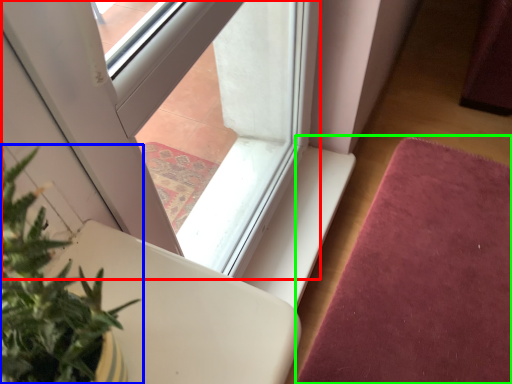
Question: Which object is the closest to the window (highlighted by a red box)? Choose among these: houseplant (highlighted by a blue box) or mat (highlighted by a green box).

Choices:
 (A) houseplant
 (B) mat

Answer: (B)